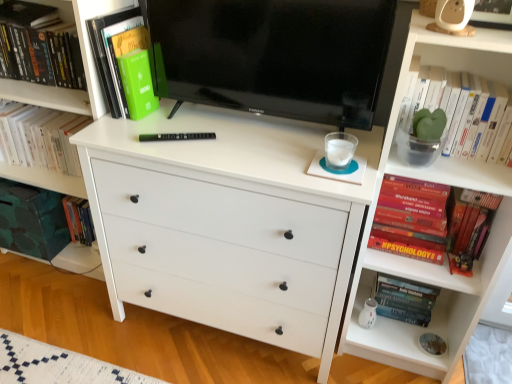
Question: Should I look upward or downward to see black glossy tv at center?

Choices:
 (A) up
 (B) down

Answer: (A)

Question: Considering the relative positions of beige plastic toy at upper right and red matte book at right, which is counted as the second book, starting from the right, in the image provided, is beige plastic toy at upper right to the right of red matte book at right, which is counted as the second book, starting from the right, from the viewer's perspective?

Choices:
 (A) yes
 (B) no

Answer: (B)

Question: Is beige plastic toy at upper right positioned beyond the bounds of red matte book at right, arranged as the 4th book when viewed from the left?

Choices:
 (A) no
 (B) yes

Answer: (B)

Question: Does beige plastic toy at upper right have a greater width compared to red matte book at right, arranged as the 4th book when viewed from the left?

Choices:
 (A) no
 (B) yes

Answer: (A)

Question: From the image's perspective, is beige plastic toy at upper right below red matte book at right, arranged as the 4th book when viewed from the left?

Choices:
 (A) no
 (B) yes

Answer: (A)

Question: From a real-world perspective, is beige plastic toy at upper right under red matte book at right, which is counted as the second book, starting from the right?

Choices:
 (A) yes
 (B) no

Answer: (B)

Question: Would you say red matte book at right, arranged as the 4th book when viewed from the left, is part of beige plastic toy at upper right's contents?

Choices:
 (A) no
 (B) yes

Answer: (A)

Question: Is green matte plant at upper right, marked as the 5th book in a left-to-right arrangement, at the left side of green matte book at upper left, placed as the fifth book when sorted from right to left?

Choices:
 (A) yes
 (B) no

Answer: (B)

Question: Is the depth of green matte plant at upper right, the 1th book positioned from the right, less than that of green matte book at upper left, placed as the fifth book when sorted from right to left?

Choices:
 (A) no
 (B) yes

Answer: (B)

Question: From a real-world perspective, is green matte plant at upper right, the 1th book positioned from the right, under green matte book at upper left, the first book positioned from the left?

Choices:
 (A) yes
 (B) no

Answer: (A)

Question: Does green matte plant at upper right, the 1th book positioned from the right, have a lesser width compared to green matte book at upper left, placed as the fifth book when sorted from right to left?

Choices:
 (A) no
 (B) yes

Answer: (B)

Question: Is green matte plant at upper right, marked as the 5th book in a left-to-right arrangement, located outside green matte book at upper left, the first book positioned from the left?

Choices:
 (A) yes
 (B) no

Answer: (A)

Question: Considering the relative sizes of green matte book at upper left, positioned as the 2th book in left-to-right order, and green matte plant at upper right, the 1th book positioned from the right, in the image provided, is green matte book at upper left, positioned as the 2th book in left-to-right order, smaller than green matte plant at upper right, the 1th book positioned from the right,?

Choices:
 (A) yes
 (B) no

Answer: (A)